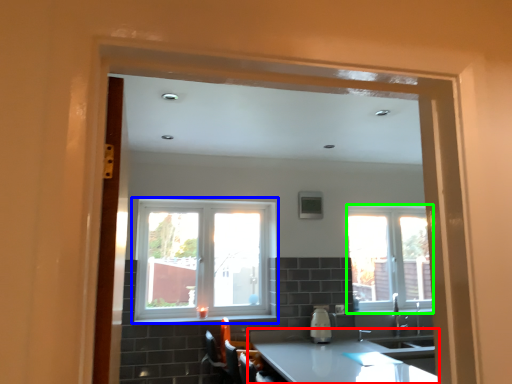
Question: Which is farther away from countertop (highlighted by a red box)? window (highlighted by a blue box) or window (highlighted by a green box)?

Choices:
 (A) window
 (B) window

Answer: (A)